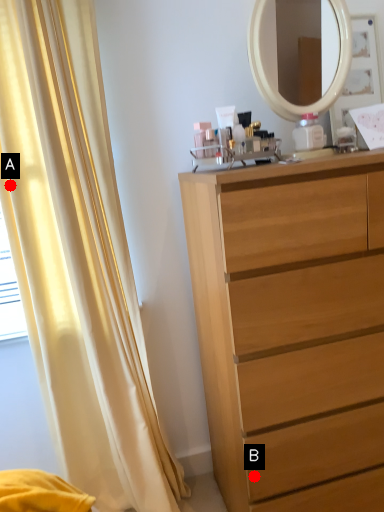
Question: Two points are circled on the image, labeled by A and B beside each circle. Which point is closer to the camera taking this photo?

Choices:
 (A) A is closer
 (B) B is closer

Answer: (B)